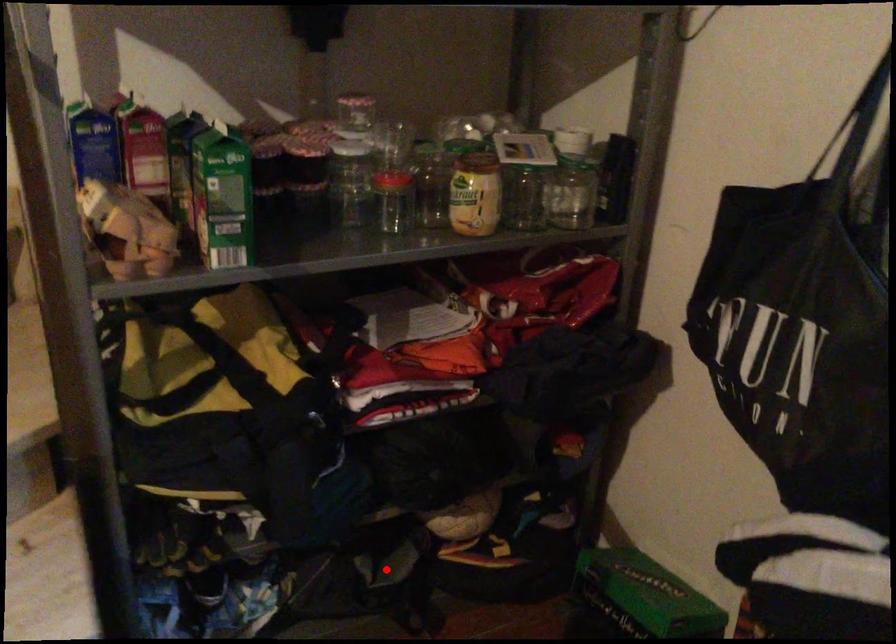
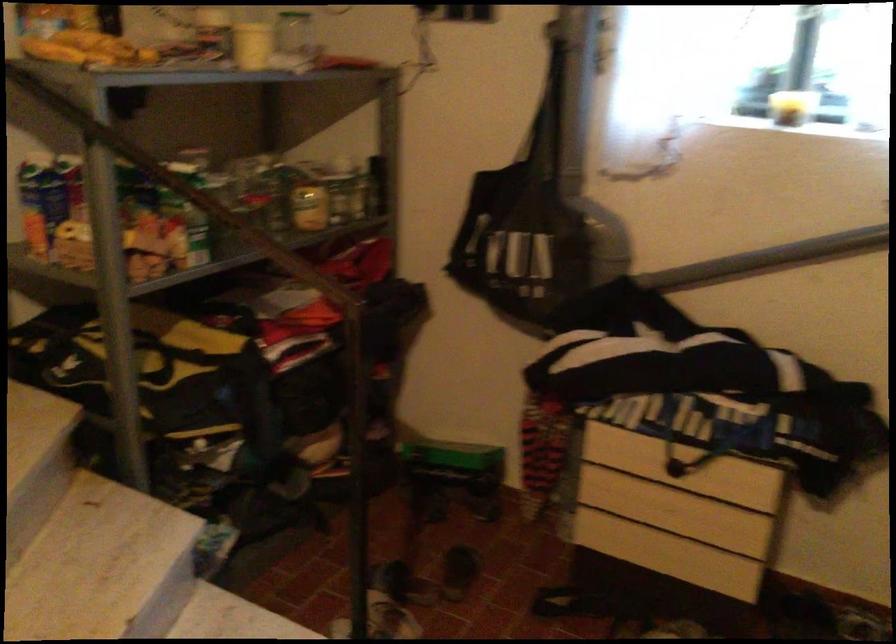
Question: I am providing you with two images of the same scene from different viewpoints. A red point is marked on the first image. At the location where the point appears in image 1, is it still visible in image 2?

Choices:
 (A) Yes
 (B) No

Answer: (A)